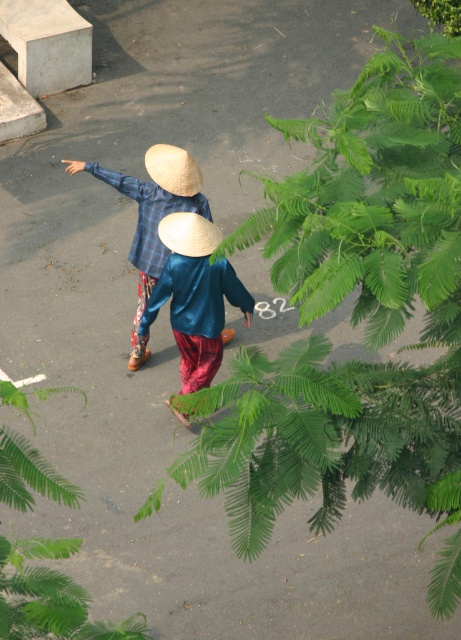
Between point (33, 477) and point (200, 241), which one is positioned behind?

Positioned behind is point (200, 241).

Does green leafy fern at lower left appear over blue silk shirt at center?

Actually, green leafy fern at lower left is below blue silk shirt at center.

Who is more forward, (30,548) or (189,257)?

Positioned in front is point (30,548).

I want to click on green leafy fern at lower left, so click(51, 596).

Can you confirm if green leafy fern at upper right is wider than natural straw hat at center?

Yes, green leafy fern at upper right is wider than natural straw hat at center.

Is green leafy fern at upper right positioned in front of natural straw hat at center?

Yes, it is in front of natural straw hat at center.

Which is in front, point (439, 83) or point (172, 240)?

Point (439, 83) is more forward.

This screenshot has height=640, width=461. Identify the location of green leafy fern at upper right. (353, 308).

Is green leafy fern at upper right thinner than green leafy fern at lower left?

No, green leafy fern at upper right is not thinner than green leafy fern at lower left.

Identify the location of green leafy fern at upper right. (353, 308).

Locate an element on the screen. Image resolution: width=461 pixels, height=640 pixels. green leafy fern at upper right is located at coordinates (353, 308).